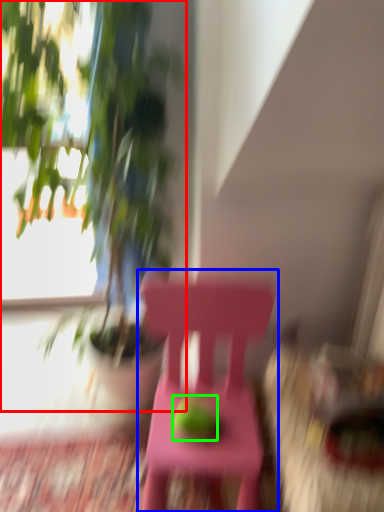
Question: Based on their relative distances, which object is nearer to houseplant (highlighted by a red box)? Choose from chair (highlighted by a blue box) and fruit (highlighted by a green box).

Choices:
 (A) chair
 (B) fruit

Answer: (A)